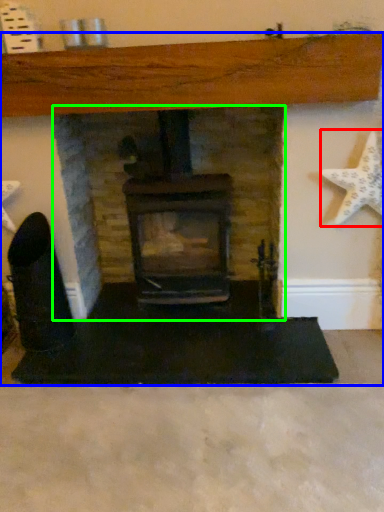
Question: Which object is the farthest from starfish (highlighted by a red box)? Choose among these: fireplace (highlighted by a blue box) or fireplace (highlighted by a green box).

Choices:
 (A) fireplace
 (B) fireplace

Answer: (B)